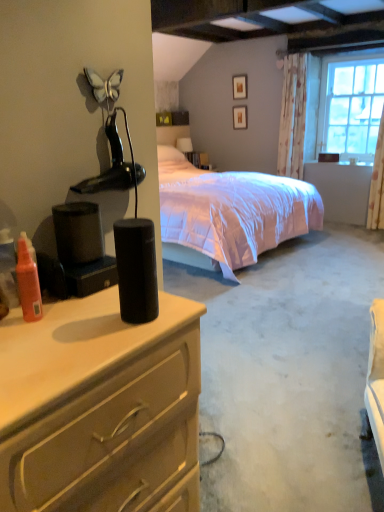
Where is `spots to the right of translucent orange spray bottle at left`? The height and width of the screenshot is (512, 384). spots to the right of translucent orange spray bottle at left is located at coordinates (84, 320).